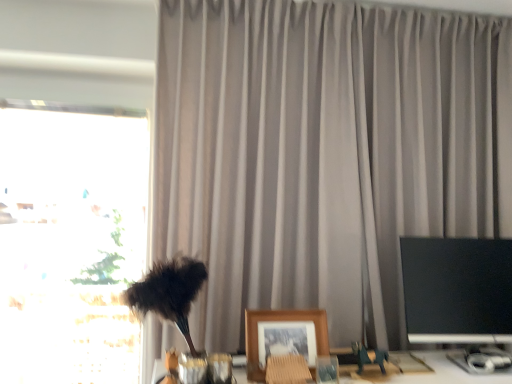
Question: Is metallic green toy horse at lower right looking in the opposite direction of black glossy monitor at right?

Choices:
 (A) no
 (B) yes

Answer: (A)

Question: From the image's perspective, is metallic green toy horse at lower right under black glossy monitor at right?

Choices:
 (A) no
 (B) yes

Answer: (B)

Question: Is metallic green toy horse at lower right far from black glossy monitor at right?

Choices:
 (A) yes
 (B) no

Answer: (B)

Question: Considering the relative sizes of metallic green toy horse at lower right and black glossy monitor at right in the image provided, is metallic green toy horse at lower right wider than black glossy monitor at right?

Choices:
 (A) no
 (B) yes

Answer: (A)

Question: Would you say metallic green toy horse at lower right contains black glossy monitor at right?

Choices:
 (A) yes
 (B) no

Answer: (B)

Question: Considering the positions of point (374, 352) and point (41, 281), is point (374, 352) closer or farther from the camera than point (41, 281)?

Choices:
 (A) farther
 (B) closer

Answer: (B)

Question: Based on their positions, is metallic green toy horse at lower right located to the left or right of transparent glass window at left?

Choices:
 (A) left
 (B) right

Answer: (B)

Question: From a real-world perspective, is metallic green toy horse at lower right positioned above or below transparent glass window at left?

Choices:
 (A) below
 (B) above

Answer: (A)

Question: Relative to transparent glass window at left, is metallic green toy horse at lower right in front or behind?

Choices:
 (A) front
 (B) behind

Answer: (A)

Question: Is point (x=99, y=215) closer or farther from the camera than point (x=411, y=294)?

Choices:
 (A) farther
 (B) closer

Answer: (A)

Question: Looking at their shapes, would you say transparent glass window at left is wider or thinner than black glossy monitor at right?

Choices:
 (A) wide
 (B) thin

Answer: (A)

Question: In terms of height, does transparent glass window at left look taller or shorter compared to black glossy monitor at right?

Choices:
 (A) short
 (B) tall

Answer: (B)

Question: Is transparent glass window at left inside or outside of black glossy monitor at right?

Choices:
 (A) inside
 (B) outside

Answer: (B)

Question: In terms of size, does black glossy monitor at right appear bigger or smaller than transparent glass window at left?

Choices:
 (A) big
 (B) small

Answer: (B)

Question: In terms of height, does black glossy monitor at right look taller or shorter compared to transparent glass window at left?

Choices:
 (A) tall
 (B) short

Answer: (B)